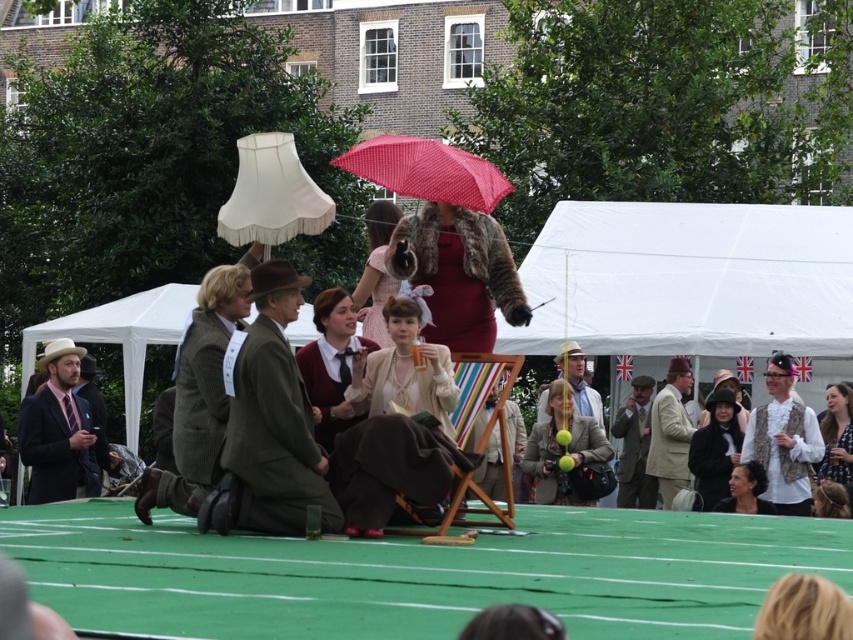
Is point (341, 419) more distant than point (577, 385)?

No.

Between velvet maroon sweater at center and light brown textured coat at center, which one appears on the left side from the viewer's perspective?

From the viewer's perspective, velvet maroon sweater at center appears more on the left side.

The width and height of the screenshot is (853, 640). Identify the location of velvet maroon sweater at center. (331, 364).

Where is `velvet maroon sweater at center`? Image resolution: width=853 pixels, height=640 pixels. velvet maroon sweater at center is located at coordinates (331, 364).

Which is more to the left, white fabric canopy at left or light brown tweed suit at center?

From the viewer's perspective, white fabric canopy at left appears more on the left side.

Who is more distant from viewer, (x=138, y=392) or (x=637, y=493)?

The point (x=138, y=392) is behind.

Where is `white fabric canopy at left`? This screenshot has height=640, width=853. white fabric canopy at left is located at coordinates (120, 337).

Is pink dotted fabric umbrella at upper center to the left of matte pink dress at center from the viewer's perspective?

In fact, pink dotted fabric umbrella at upper center is to the right of matte pink dress at center.

From the picture: Does pink dotted fabric umbrella at upper center have a greater width compared to matte pink dress at center?

Yes.

You are a GUI agent. You are given a task and a screenshot of the screen. Output one action in this format:
    pyautogui.click(x=<x>, y=<y>)
    Task: Click on the pink dotted fabric umbrella at upper center
    
    Given the screenshot: What is the action you would take?
    [426, 170]

I want to click on pink dotted fabric umbrella at upper center, so click(426, 170).